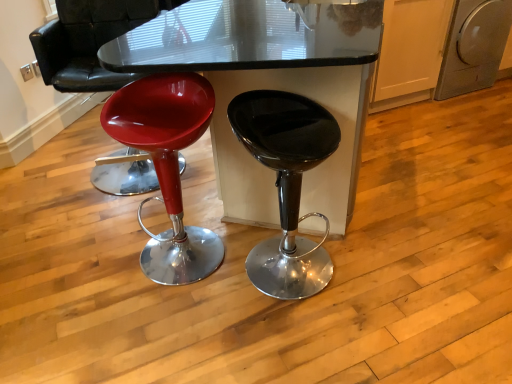
Identify the location of free region on the left part of glossy black stool at center, arranged as the 2th stool when viewed from the left. The width and height of the screenshot is (512, 384). (192, 308).